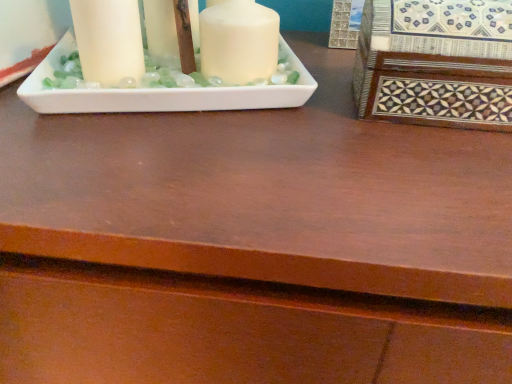
Where is `vacant space situated on the left part of inlaid wood box at right`? The image size is (512, 384). vacant space situated on the left part of inlaid wood box at right is located at coordinates (288, 136).